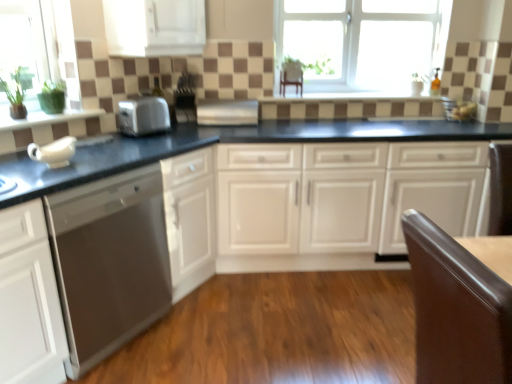
Question: From the image's perspective, is white glass window at upper center located above or below satin silver toaster at center, arranged as the 2th appliance when viewed from the right?

Choices:
 (A) below
 (B) above

Answer: (B)

Question: Is white glass window at upper center wider or thinner than satin silver toaster at center, arranged as the 2th appliance when viewed from the right?

Choices:
 (A) wide
 (B) thin

Answer: (B)

Question: Which object is the closest to the satin silver toaster at center, which appears as the first appliance when viewed from the right?

Choices:
 (A) satin stainless steel dishwasher at left
 (B) white glass window at upper center
 (C) satin silver toaster at center, placed as the 1th appliance when sorted from left to right
 (D) glossy brown chair at lower right
 (E) white glossy cabinets at center, the first cabinetry from the right

Answer: (C)

Question: Considering the real-world distances, which object is farthest from the white glass window at upper center?

Choices:
 (A) white glossy cabinets at center, the first cabinetry in the bottom-to-top sequence
 (B) glossy brown chair at lower right
 (C) satin silver toaster at center
 (D) satin silver toaster at center, placed as the 1th appliance when sorted from left to right
 (E) satin stainless steel dishwasher at left

Answer: (B)